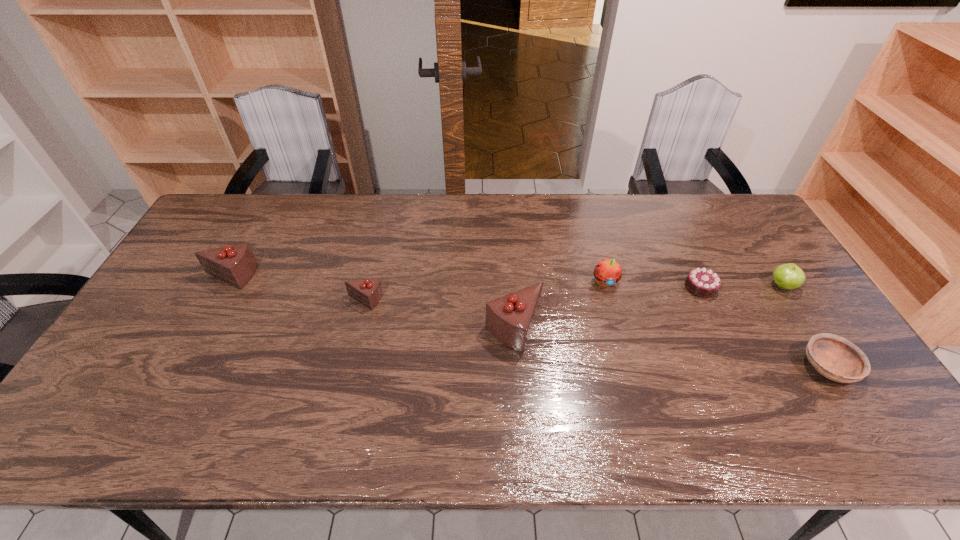
Find the location of a particular element. free location located on the front of the second tallest object is located at coordinates (207, 316).

Find the location of a particular element. The width and height of the screenshot is (960, 540). vacant space located on the left of the third tallest chocolate cake is located at coordinates (292, 300).

The width and height of the screenshot is (960, 540). Identify the location of vacant space situated on the left of the fifth object from right to left. (435, 328).

I want to click on free space located 0.060m on the right of the shortest chocolate cake, so click(735, 287).

Identify the location of free space located on the left of the bowl. This screenshot has width=960, height=540. (700, 367).

Where is `free region located 0.250m on the left of the left apple`? The height and width of the screenshot is (540, 960). free region located 0.250m on the left of the left apple is located at coordinates (508, 281).

Where is `blank area located on the front of the right apple`? The width and height of the screenshot is (960, 540). blank area located on the front of the right apple is located at coordinates (841, 376).

Identify the location of object positioned at the near edge. The width and height of the screenshot is (960, 540). (836, 358).

Where is `object at the left edge`? The image size is (960, 540). object at the left edge is located at coordinates (235, 265).

Locate an element on the screen. The image size is (960, 540). bowl located in the right edge section of the desktop is located at coordinates (836, 358).